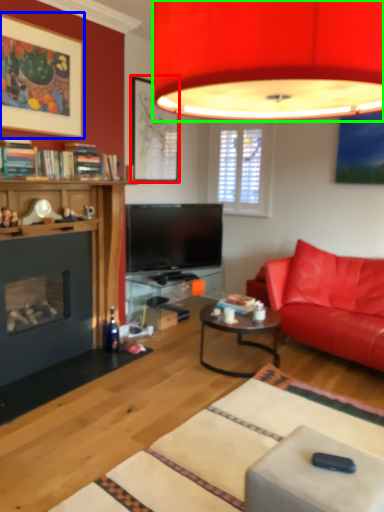
Question: Based on their relative distances, which object is farther from picture frame (highlighted by a red box)? Choose from picture frame (highlighted by a blue box) and lamp (highlighted by a green box).

Choices:
 (A) picture frame
 (B) lamp

Answer: (B)